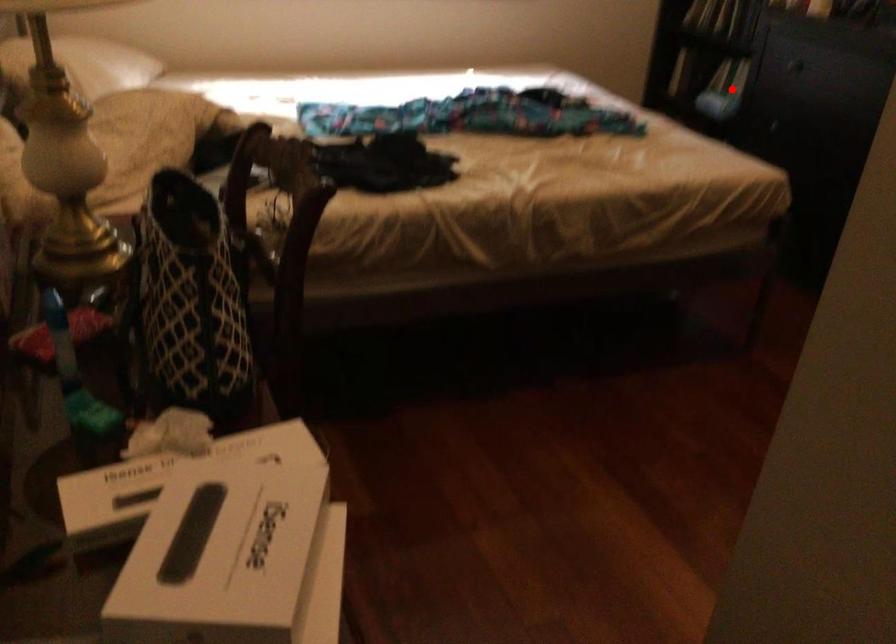
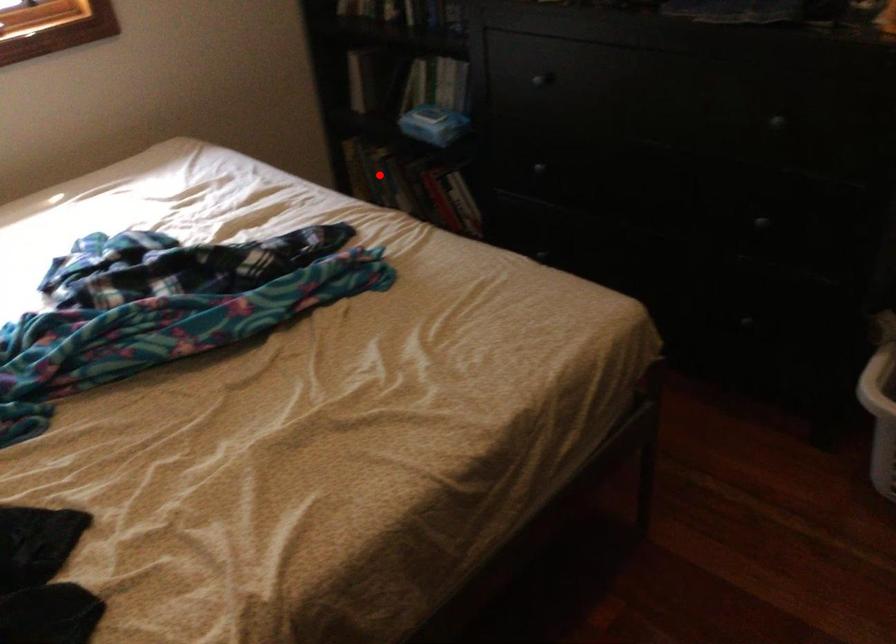
I am providing you with two images of the same scene from different viewpoints. A red point is marked on the first image and another point is marked on the second image. Is the red point in image1 aligned with the point shown in image2?

No